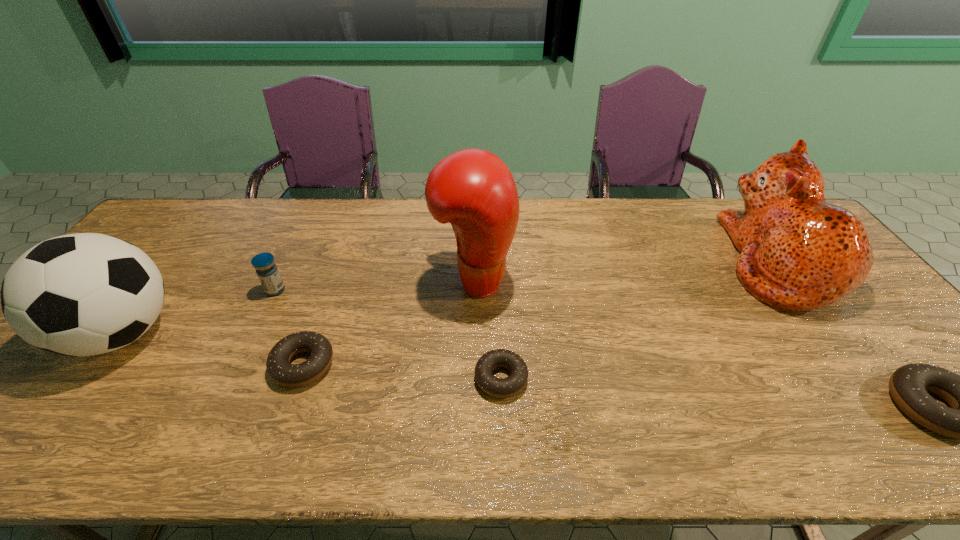
Image resolution: width=960 pixels, height=540 pixels. In order to click on free space between the tallest object and the cat in this screenshot , I will do `click(626, 271)`.

I want to click on empty location between the second shortest object and the fourth shortest object, so click(x=289, y=327).

Locate which object is the closest to the rightmost doughnut. Please provide its 2D coordinates. Your answer should be formatted as a tuple, i.e. [(x, y)], where the tuple contains the x and y coordinates of a point satisfying the conditions above.

[(798, 253)]

Where is `object that is the fourth closest to the second doughnut from right to left`? This screenshot has height=540, width=960. object that is the fourth closest to the second doughnut from right to left is located at coordinates (798, 253).

Locate which doughnut ranks second in proximity to the soccer ball. Please provide its 2D coordinates. Your answer should be formatted as a tuple, i.e. [(x, y)], where the tuple contains the x and y coordinates of a point satisfying the conditions above.

[(497, 387)]

Choose which doughnut is the third nearest neighbor to the second object from left to right. Please provide its 2D coordinates. Your answer should be formatted as a tuple, i.e. [(x, y)], where the tuple contains the x and y coordinates of a point satisfying the conditions above.

[(908, 385)]

Image resolution: width=960 pixels, height=540 pixels. Find the location of `free spot that satisfies the following two spatial constraints: 1. on the back side of the medicine; 2. on the right side of the soccer ball`. free spot that satisfies the following two spatial constraints: 1. on the back side of the medicine; 2. on the right side of the soccer ball is located at coordinates (156, 290).

Locate an element on the screen. The height and width of the screenshot is (540, 960). free spot that satisfies the following two spatial constraints: 1. on the face of the cat; 2. on the front side of the shortest object is located at coordinates (865, 378).